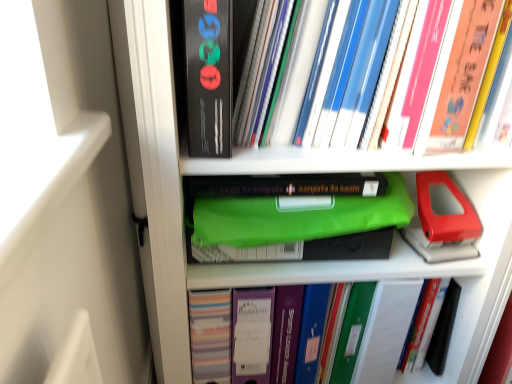
Question: From the image's perspective, is hardcover books at upper right, placed as the 1th book when sorted from top to bottom, on top of matte black book at upper center?

Choices:
 (A) no
 (B) yes

Answer: (A)

Question: From a real-world perspective, is hardcover books at upper right, placed as the 1th book when sorted from top to bottom, over matte black book at upper center?

Choices:
 (A) no
 (B) yes

Answer: (A)

Question: Would you say hardcover books at upper right, positioned as the second book in bottom-to-top order, is outside matte black book at upper center?

Choices:
 (A) yes
 (B) no

Answer: (A)

Question: Is hardcover books at upper right, placed as the 1th book when sorted from top to bottom, further to camera compared to matte black book at upper center?

Choices:
 (A) yes
 (B) no

Answer: (A)

Question: From a real-world perspective, is hardcover books at upper right, placed as the 1th book when sorted from top to bottom, physically below matte black book at upper center?

Choices:
 (A) yes
 (B) no

Answer: (A)

Question: Is hardcover books at upper right, positioned as the second book in bottom-to-top order, taller than matte black book at upper center?

Choices:
 (A) no
 (B) yes

Answer: (A)

Question: Is matte plastic binder at center, which ranks as the 2th book in top-to-bottom order, placed right next to hardcover books at upper right, placed as the 1th book when sorted from top to bottom?

Choices:
 (A) no
 (B) yes

Answer: (A)

Question: Is there a large distance between matte plastic binder at center, which ranks as the 2th book in top-to-bottom order, and hardcover books at upper right, positioned as the second book in bottom-to-top order?

Choices:
 (A) no
 (B) yes

Answer: (A)

Question: Is matte plastic binder at center, marked as the 1th book in a bottom-to-top arrangement, at the left side of hardcover books at upper right, positioned as the second book in bottom-to-top order?

Choices:
 (A) no
 (B) yes

Answer: (B)

Question: Is hardcover books at upper right, placed as the 1th book when sorted from top to bottom, located within matte plastic binder at center, marked as the 1th book in a bottom-to-top arrangement?

Choices:
 (A) yes
 (B) no

Answer: (B)

Question: Is matte plastic binder at center, which ranks as the 2th book in top-to-bottom order, completely or partially outside of hardcover books at upper right, positioned as the second book in bottom-to-top order?

Choices:
 (A) yes
 (B) no

Answer: (A)

Question: From the image's perspective, is matte plastic binder at center, marked as the 1th book in a bottom-to-top arrangement, on top of hardcover books at upper right, placed as the 1th book when sorted from top to bottom?

Choices:
 (A) yes
 (B) no

Answer: (B)

Question: Would you say hardcover books at upper right, positioned as the second book in bottom-to-top order, is part of matte black book at upper center's contents?

Choices:
 (A) yes
 (B) no

Answer: (B)